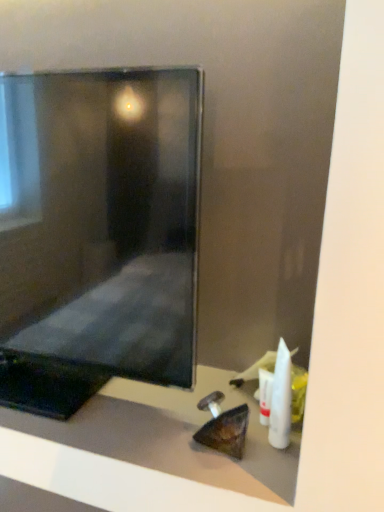
I want to click on vacant space situated on the left part of white plastic toothbrush at lower right, which ranks as the first toiletry in front-to-back order, so click(170, 434).